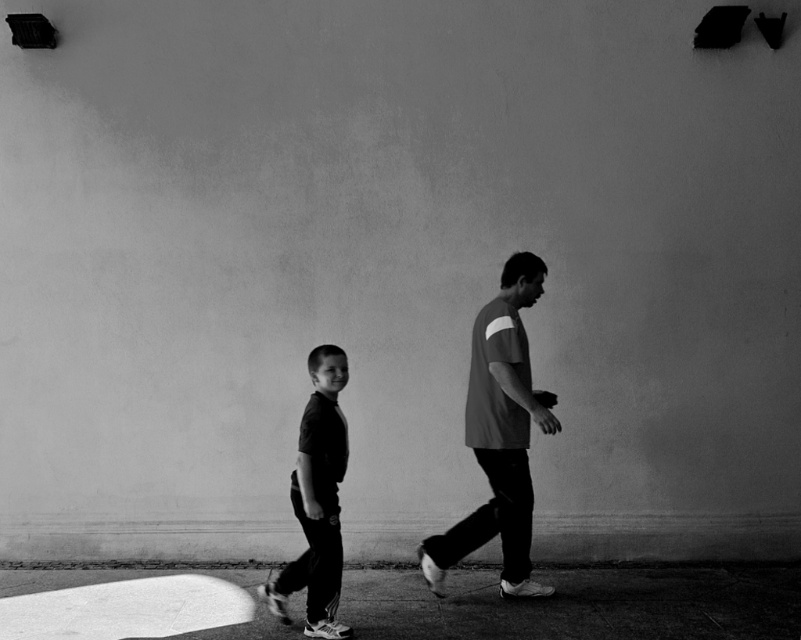
You are a tailor measuring the distance between two pieces of clothing for a custom fitting. The gray cotton shirt at center and dark gray fabric pants at left need to be displayed together in a store window. The display requires a minimum of 30 inches between items for visibility. Can these items be placed as required?

The gray cotton shirt at center and dark gray fabric pants at left are 32.25 inches apart, which exceeds the minimum requirement of 30 inches. Therefore, they can be placed as required.

You are a tailor who needs to compare the widths of the gray cotton shirt at center and the dark gray fabric pants at left for a fitting. Which clothing item is wider?

The gray cotton shirt at center is wider than the dark gray fabric pants at left according to the description.